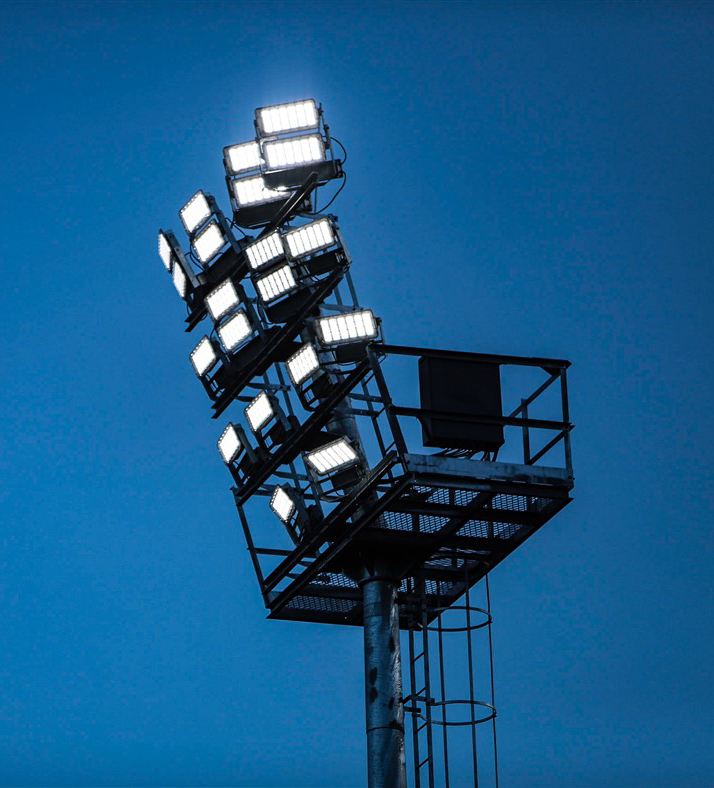
I want to click on ladder steps, so click(418, 764), click(417, 727), click(418, 696), click(418, 662), click(416, 615), click(416, 571).